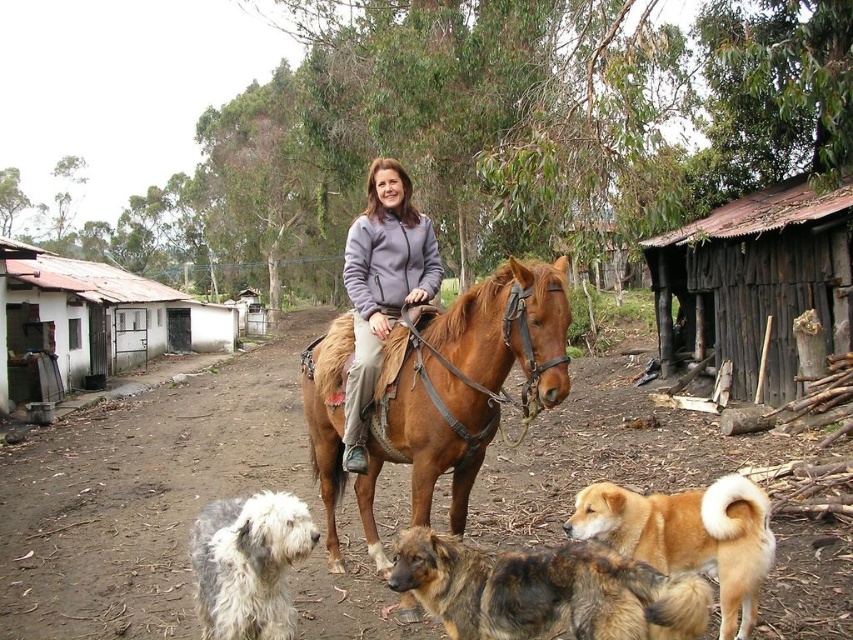
Consider the image. Does brown leather horse at center appear on the right side of brown shaggy dog at lower center?

Yes, brown leather horse at center is to the right of brown shaggy dog at lower center.

Does brown leather horse at center come in front of brown shaggy dog at lower center?

No, brown leather horse at center is further to the viewer.

Does point (489, 396) come farther from viewer compared to point (515, 592)?

Yes, it is.

Locate an element on the screen. Image resolution: width=853 pixels, height=640 pixels. brown leather horse at center is located at coordinates (463, 385).

Between weathered wood hut at center-right and gray fleece jacket at center, which one appears on the right side from the viewer's perspective?

weathered wood hut at center-right

Can you confirm if weathered wood hut at center-right is shorter than gray fleece jacket at center?

Yes, weathered wood hut at center-right is shorter than gray fleece jacket at center.

Measure the distance between weathered wood hut at center-right and camera.

They are 8.37 meters apart.

Locate an element on the screen. weathered wood hut at center-right is located at coordinates (755, 282).

Between weathered wood hut at center-right and golden fur dog at lower right, which one is positioned higher?

weathered wood hut at center-right

Does weathered wood hut at center-right appear over golden fur dog at lower right?

Yes.

The image size is (853, 640). I want to click on weathered wood hut at center-right, so click(x=755, y=282).